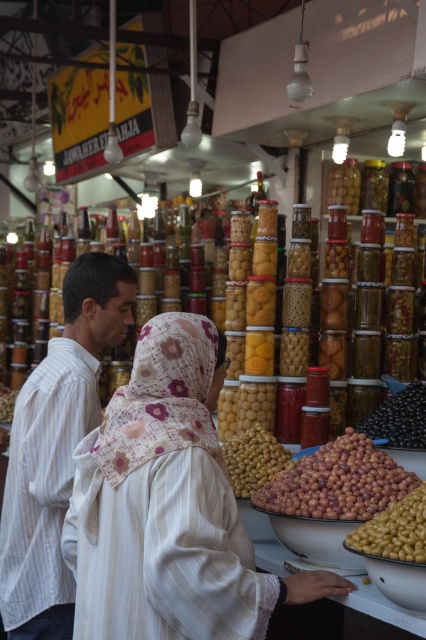
Based on the photo, can you confirm if white striped shirt at left is smaller than green matte olives at lower right?

Incorrect, white striped shirt at left is not smaller in size than green matte olives at lower right.

Is point (71, 492) farther from viewer compared to point (402, 534)?

Yes.

Image resolution: width=426 pixels, height=640 pixels. Find the location of `white striped shirt at left`. white striped shirt at left is located at coordinates (55, 448).

Which is below, green matte olives at lower right or green matte olives at center?

Positioned lower is green matte olives at lower right.

From the picture: Does green matte olives at lower right appear under green matte olives at center?

Indeed, green matte olives at lower right is positioned under green matte olives at center.

Between point (417, 506) and point (250, 432), which one is positioned behind?

Point (250, 432)

Identify the location of green matte olives at lower right. The image size is (426, 640). (394, 531).

How distant is white striped shirt at left from black glossy olives at center?

white striped shirt at left is 6.12 feet away from black glossy olives at center.

Who is more forward, (19,436) or (399,396)?

Point (19,436)

In order to click on white striped shirt at left in this screenshot , I will do `click(55, 448)`.

This screenshot has width=426, height=640. What are the coordinates of `white striped shirt at left` in the screenshot? It's located at (55, 448).